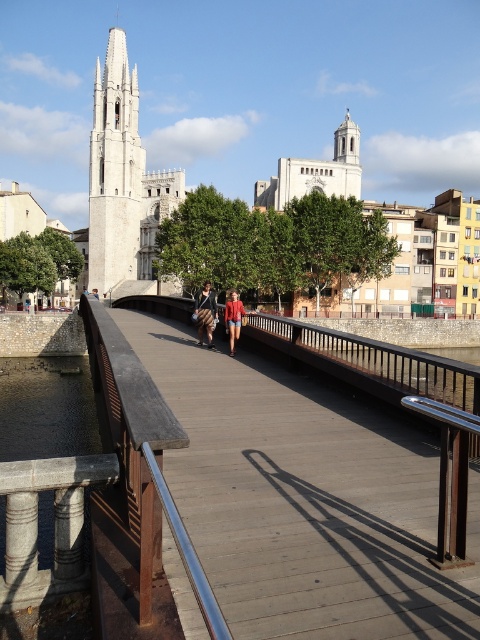
Can you confirm if wooden bridge at center is bigger than striped fabric skirt at center?

Yes.

Is wooden bridge at center positioned behind striped fabric skirt at center?

No, wooden bridge at center is closer to the viewer.

At what (x,y) coordinates should I click in order to perform the action: click on wooden bridge at center. Please return your answer as a coordinate pair (x, y). This screenshot has width=480, height=640. Looking at the image, I should click on (300, 499).

Between point (132, 240) and point (233, 323), which one is positioned in front?

Point (233, 323) is in front.

Between point (103, 225) and point (232, 320), which one is positioned in front?

Point (232, 320)

Locate an element on the screen. The height and width of the screenshot is (640, 480). white stone tower at upper left is located at coordinates (115, 170).

Does white stone tower at upper left appear under striped fabric skirt at center?

No.

Is point (120, 240) positioned behind point (212, 292)?

That is True.

Does point (117, 129) come farther from viewer compared to point (196, 300)?

Yes, it is.

The width and height of the screenshot is (480, 640). I want to click on white stone tower at upper left, so click(115, 170).